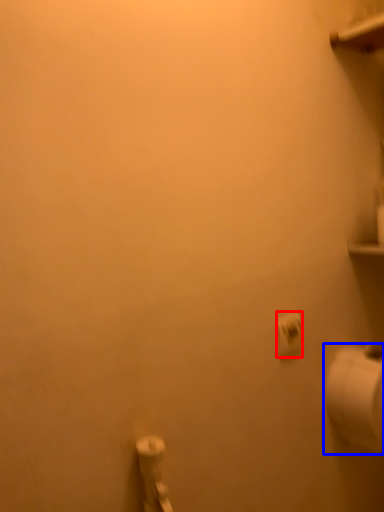
Question: Which of the following is the closest to the observer, toilet paper (highlighted by a red box) or toilet paper (highlighted by a blue box)?

Choices:
 (A) toilet paper
 (B) toilet paper

Answer: (A)